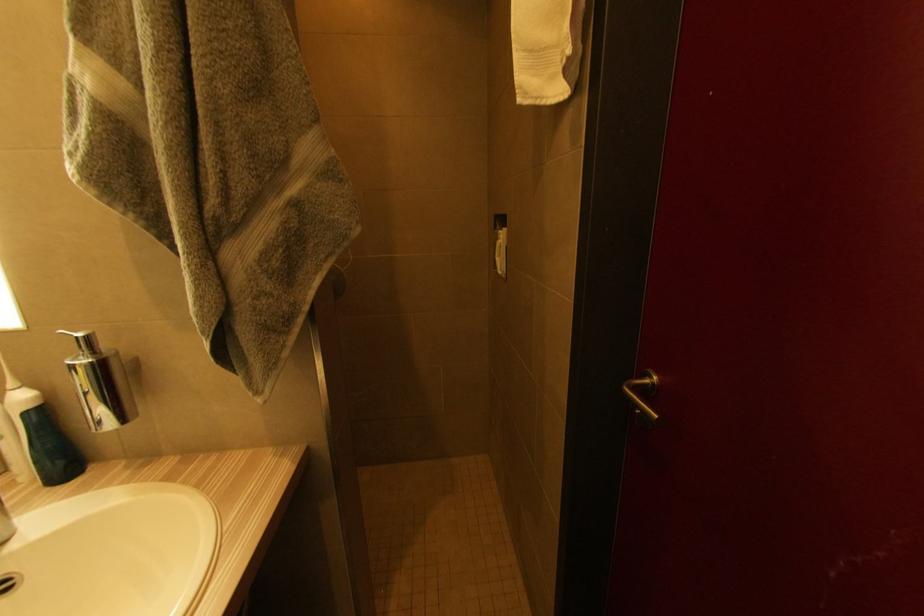
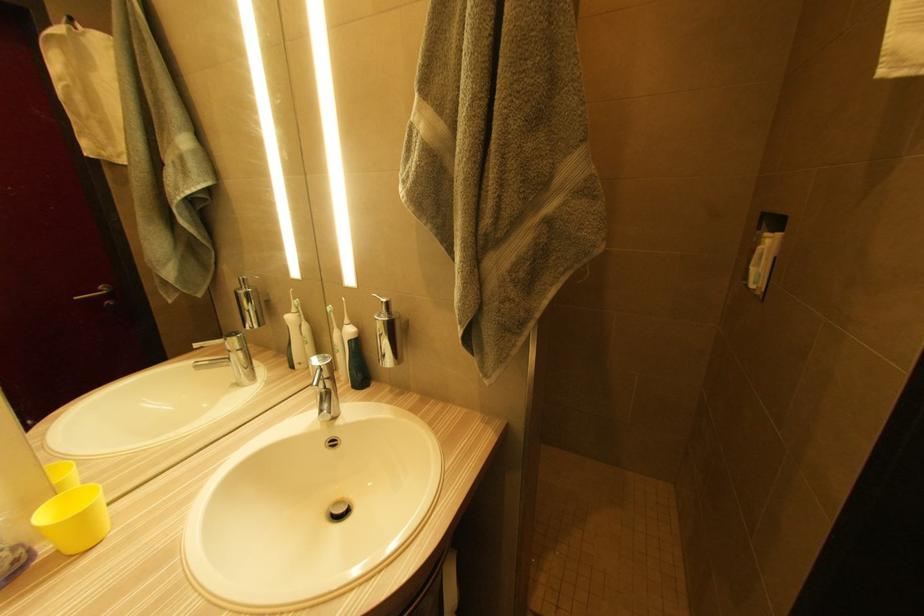
Question: How did the camera likely rotate?

Choices:
 (A) Left
 (B) Right
 (C) Up
 (D) Down

Answer: (A)